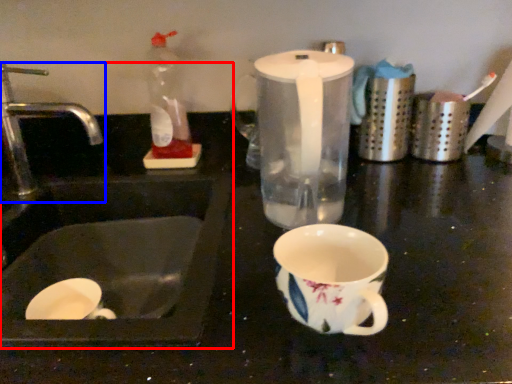
Question: Which point is further to the camera, sink (highlighted by a red box) or tap (highlighted by a blue box)?

Choices:
 (A) sink
 (B) tap

Answer: (B)